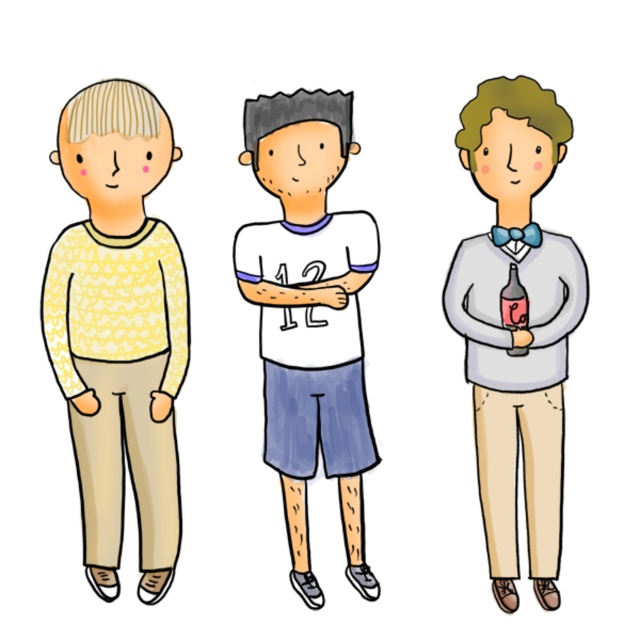
You are an artist trying to draw the scene described. You need to place the matte gray sweater at right in your drawing. According to the scene description, where should you position it in terms of coordinates?

The matte gray sweater at right should be positioned at coordinates point [518,330].

You are organizing a clothing store and need to place the matte gray sweater at right and the translucent glass bottle at center on adjacent shelves. The shelves have limited width. Based on their sizes, which item should be placed on the wider shelf?

The matte gray sweater at right should be placed on the wider shelf because its width is larger than the translucent glass bottle at center, requiring more space.